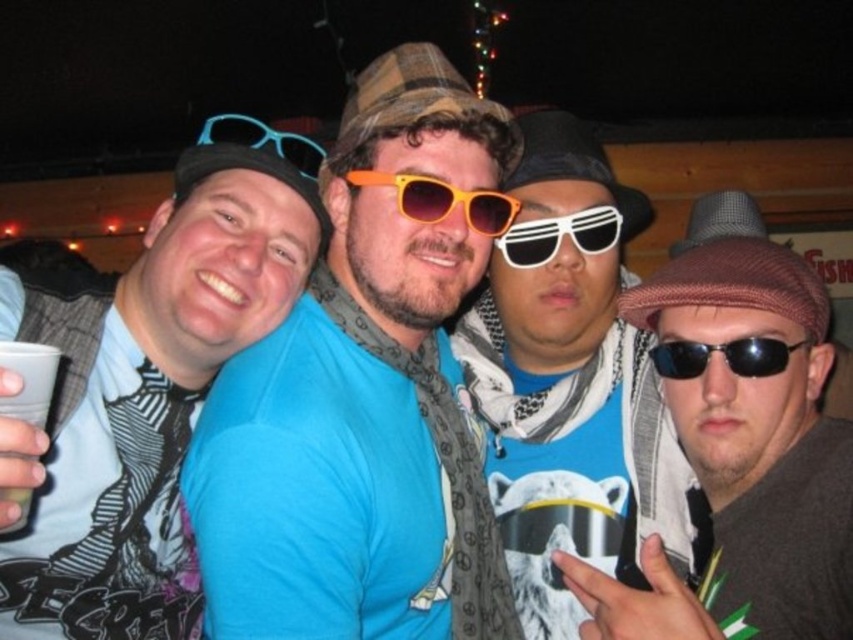
You are a photographer trying to capture a closeup shot of the matte black cap at left and the orange plastic sunglasses at center. Since you want to focus on both items equally, which object should you adjust your camera lens to prioritize in terms of size to ensure both appear balanced in the frame?

The matte black cap at left is wider than the orange plastic sunglasses at center. To balance their sizes in the frame, you should adjust the camera lens to make the matte black cap at left appear smaller or move closer to the orange plastic sunglasses at center so both objects occupy similar visual space.

You are a photographer trying to adjust the focus of your camera for the group photo. You notice two points in the scene at coordinates point (x=175, y=465) and point (x=770, y=515). Which point should you focus on first to ensure the closest subject is sharp?

You should focus on point (x=175, y=465) first because it is closer to the camera than point 0.804, 0.904, ensuring the nearest subject is in sharp focus.